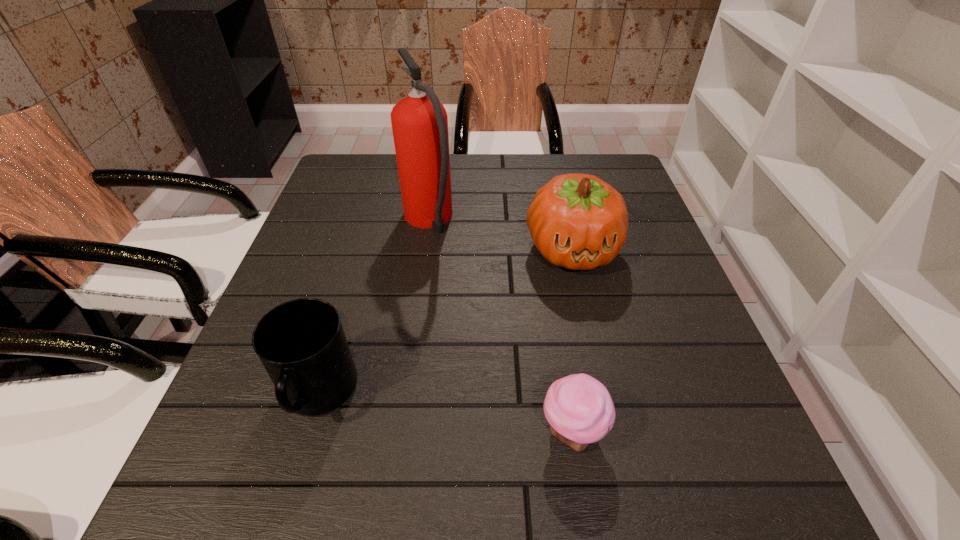
Locate which object ranks second in proximity to the tallest object. Please provide its 2D coordinates. Your answer should be formatted as a tuple, i.e. [(x, y)], where the tuple contains the x and y coordinates of a point satisfying the conditions above.

[(301, 343)]

I want to click on the second closest object relative to the mug, so click(579, 408).

Where is `vacant space that satisfies the following two spatial constraints: 1. on the side of the cupcake with the handle; 2. on the left side of the second shortest object`? This screenshot has height=540, width=960. vacant space that satisfies the following two spatial constraints: 1. on the side of the cupcake with the handle; 2. on the left side of the second shortest object is located at coordinates (307, 433).

This screenshot has height=540, width=960. I want to click on free location that satisfies the following two spatial constraints: 1. on the side of the cupcake with the handle; 2. on the left side of the mug, so click(307, 433).